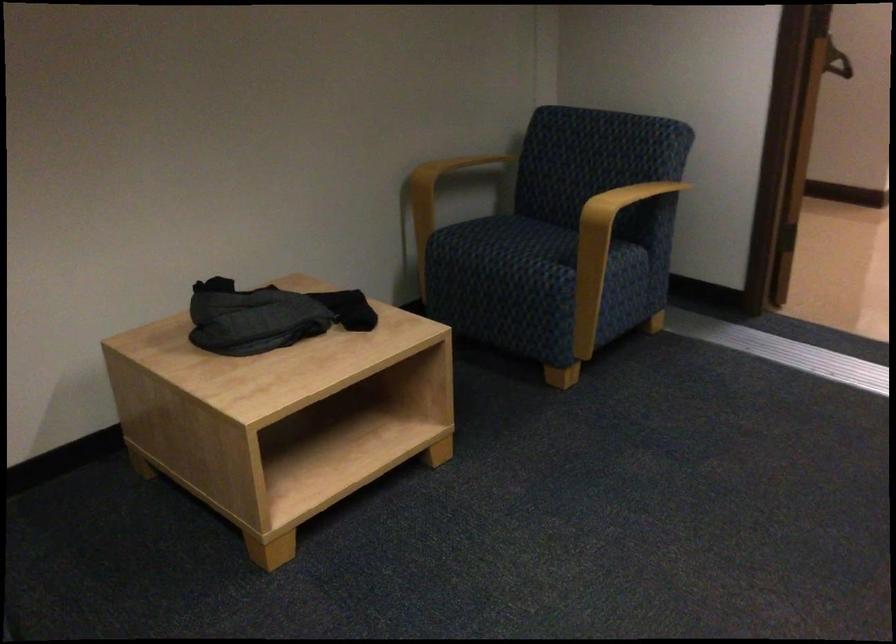
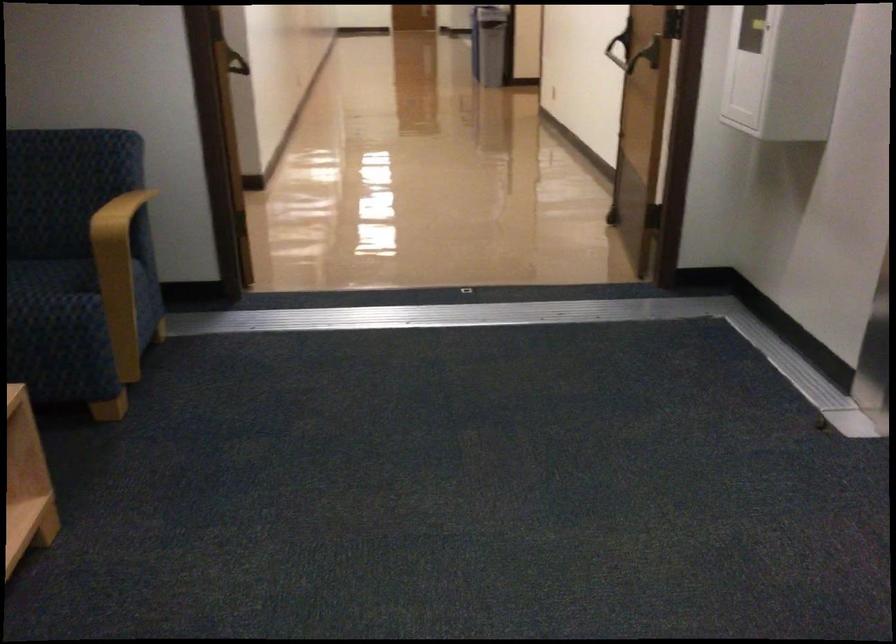
Where in the second image is the point corresponding to (x=612, y=218) from the first image?

(88, 245)